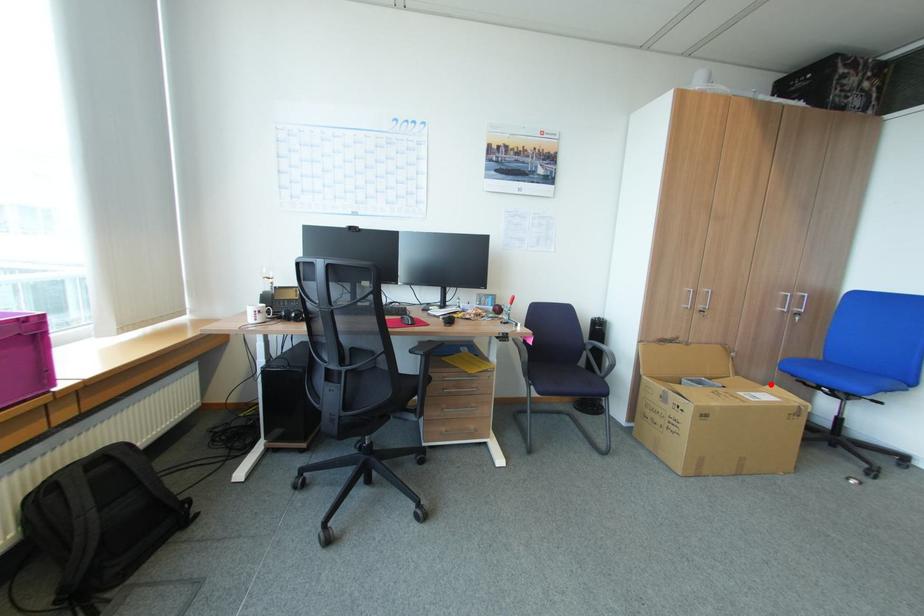
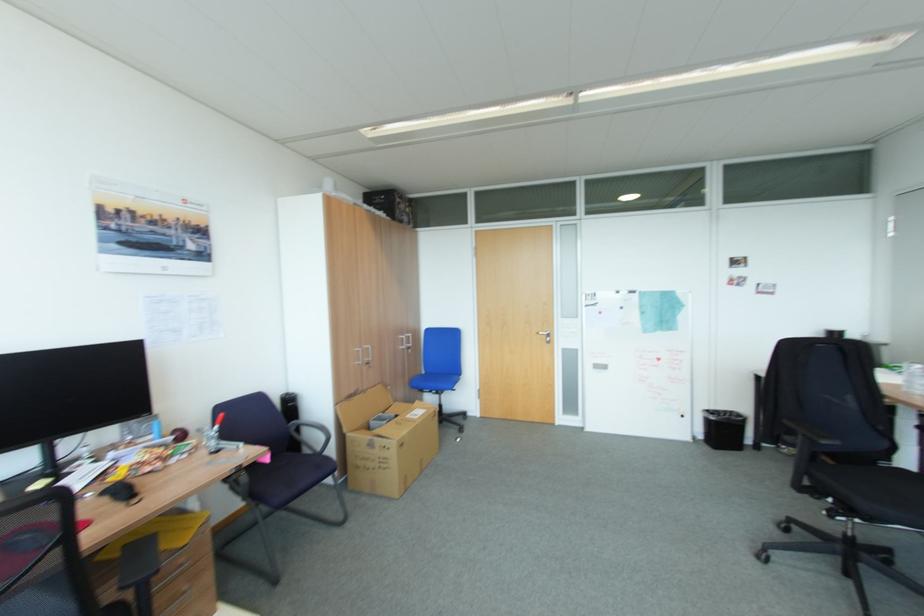
Question: I am providing you with two images of the same scene from different viewpoints. A red point is shown in image1. For the corresponding object point in image2, is it positioned nearer or farther from the camera?

Choices:
 (A) Nearer
 (B) Farther

Answer: (A)